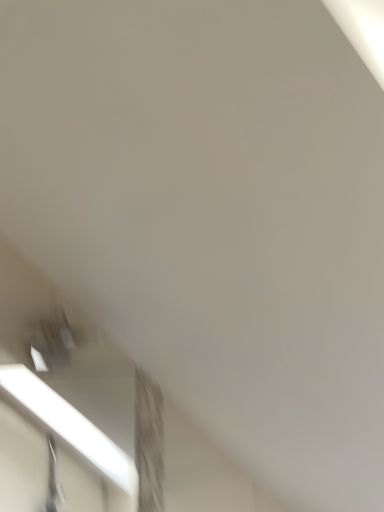
Image resolution: width=384 pixels, height=512 pixels. In order to click on white glossy window at lower left in this screenshot , I will do `click(70, 425)`.

What do you see at coordinates (70, 425) in the screenshot? The height and width of the screenshot is (512, 384). I see `white glossy window at lower left` at bounding box center [70, 425].

Find the location of a particular element. Image resolution: width=384 pixels, height=512 pixels. white glossy window at lower left is located at coordinates (70, 425).